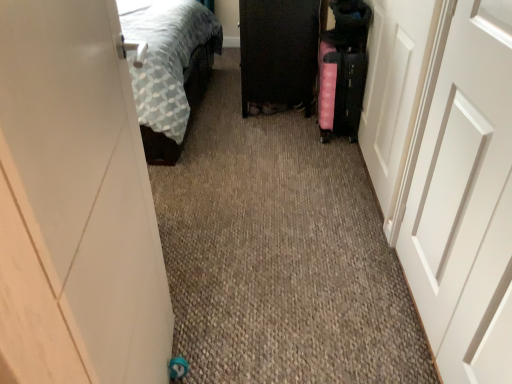
This screenshot has height=384, width=512. I want to click on free space to the left of white glossy door at right, which is the third door from left to right, so click(273, 177).